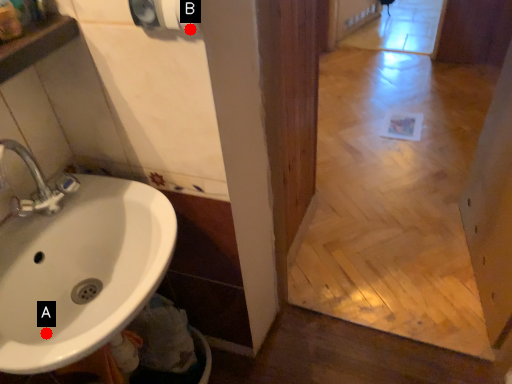
Question: Two points are circled on the image, labeled by A and B beside each circle. Which point appears closest to the camera in this image?

Choices:
 (A) A is closer
 (B) B is closer

Answer: (B)